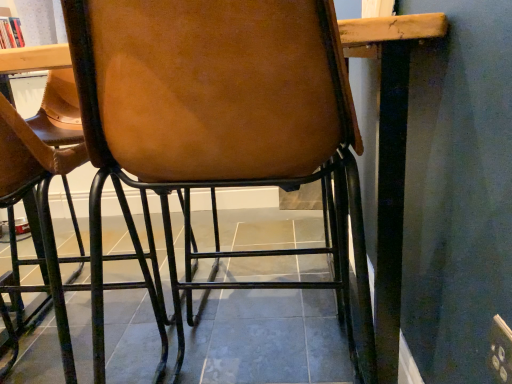
What do you see at coordinates (222, 120) in the screenshot? The image size is (512, 384). I see `brown leather chair at center` at bounding box center [222, 120].

Find the location of a particular element. The image size is (512, 384). brown leather chair at center is located at coordinates (222, 120).

The width and height of the screenshot is (512, 384). Find the location of `white textured curtain at upper left`. white textured curtain at upper left is located at coordinates (41, 22).

Image resolution: width=512 pixels, height=384 pixels. What do you see at coordinates (41, 22) in the screenshot?
I see `white textured curtain at upper left` at bounding box center [41, 22].

What is the approximate width of white textured curtain at upper left?

white textured curtain at upper left is 10.25 centimeters wide.

Identify the location of brown leather chair at center. The image size is (512, 384). (222, 120).

Can you confirm if white textured curtain at upper left is positioned to the right of brown leather chair at center?

No, white textured curtain at upper left is not to the right of brown leather chair at center.

Which object is more forward, white textured curtain at upper left or brown leather chair at center?

brown leather chair at center.

Which is farther from the camera, (25,21) or (116,139)?

The point (25,21) is behind.

From the picture: From the image's perspective, is white textured curtain at upper left above or below brown leather chair at center?

From the image's perspective, white textured curtain at upper left appears above brown leather chair at center.

From the picture: From a real-world perspective, which is physically below, white textured curtain at upper left or brown leather chair at center?

In real-world perspective, brown leather chair at center is lower.

Does white textured curtain at upper left have a lesser width compared to brown leather chair at center?

Indeed, white textured curtain at upper left has a lesser width compared to brown leather chair at center.

Considering the sizes of objects white textured curtain at upper left and brown leather chair at center in the image provided, who is taller, white textured curtain at upper left or brown leather chair at center?

Standing taller between the two is brown leather chair at center.

Which of these two, white textured curtain at upper left or brown leather chair at center, is smaller?

With smaller size is white textured curtain at upper left.

Would you say white textured curtain at upper left is inside or outside brown leather chair at center?

white textured curtain at upper left is not enclosed by brown leather chair at center.

Does white textured curtain at upper left touch brown leather chair at center?

No, white textured curtain at upper left is not next to brown leather chair at center.

Is white textured curtain at upper left aimed at brown leather chair at center?

No, white textured curtain at upper left is not turned towards brown leather chair at center.

What's the angular difference between white textured curtain at upper left and brown leather chair at center's facing directions?

There is a 93.2-degree angle between the facing directions of white textured curtain at upper left and brown leather chair at center.

Identify the location of curtain that appears behind the brown leather chair at center. Image resolution: width=512 pixels, height=384 pixels. (41, 22).

Which is more to the left, brown leather chair at center or white textured curtain at upper left?

From the viewer's perspective, white textured curtain at upper left appears more on the left side.

Does brown leather chair at center come behind white textured curtain at upper left?

No, the depth of brown leather chair at center is less than that of white textured curtain at upper left.

Considering the points (350, 160) and (37, 31), which point is in front, point (350, 160) or point (37, 31)?

Positioned in front is point (350, 160).

From the image's perspective, which is above, brown leather chair at center or white textured curtain at upper left?

white textured curtain at upper left is shown above in the image.

From a real-world perspective, which is physically below, brown leather chair at center or white textured curtain at upper left?

From a 3D spatial view, brown leather chair at center is below.

Which of these two, brown leather chair at center or white textured curtain at upper left, is thinner?

Thinner between the two is white textured curtain at upper left.

Considering the relative sizes of brown leather chair at center and white textured curtain at upper left in the image provided, is brown leather chair at center taller than white textured curtain at upper left?

Correct, brown leather chair at center is much taller as white textured curtain at upper left.

Which of these two, brown leather chair at center or white textured curtain at upper left, is smaller?

white textured curtain at upper left.

Is brown leather chair at center situated inside white textured curtain at upper left or outside?

brown leather chair at center is spatially situated outside white textured curtain at upper left.

Is brown leather chair at center beside white textured curtain at upper left?

No, brown leather chair at center is not with white textured curtain at upper left.

Is brown leather chair at center oriented away from white textured curtain at upper left?

No, brown leather chair at center is not facing the opposite direction of white textured curtain at upper left.

Can you tell me how much brown leather chair at center and white textured curtain at upper left differ in facing direction?

93.2 degrees separate the facing orientations of brown leather chair at center and white textured curtain at upper left.

What are the coordinates of `chair on the right of white textured curtain at upper left` in the screenshot? It's located at (222, 120).

The image size is (512, 384). Identify the location of curtain above the brown leather chair at center (from a real-world perspective). (41, 22).

In the image, there is a white textured curtain at upper left. Identify the location of chair below it (from the image's perspective). (222, 120).